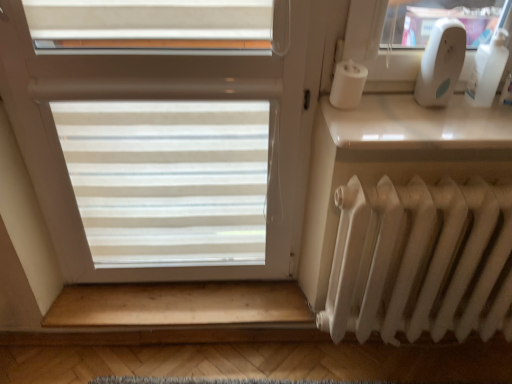
Where is `vacant space situated above white glossy window sill at upper right (from a real-world perspective)`? The height and width of the screenshot is (384, 512). vacant space situated above white glossy window sill at upper right (from a real-world perspective) is located at coordinates (423, 112).